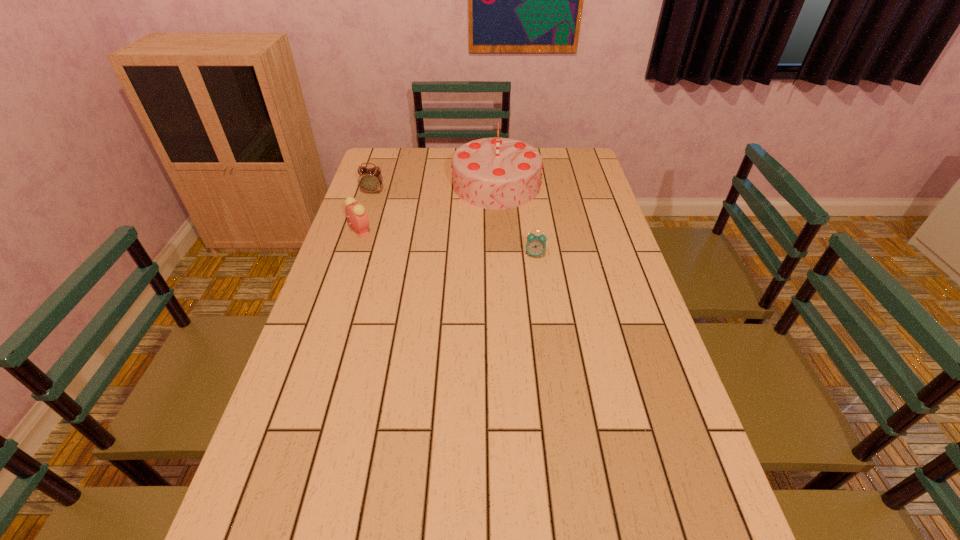
This screenshot has height=540, width=960. Identify the location of vacant space that satisfies the following two spatial constraints: 1. on the face of the farthest alarm clock; 2. on the face of the third farthest object. coord(360,231).